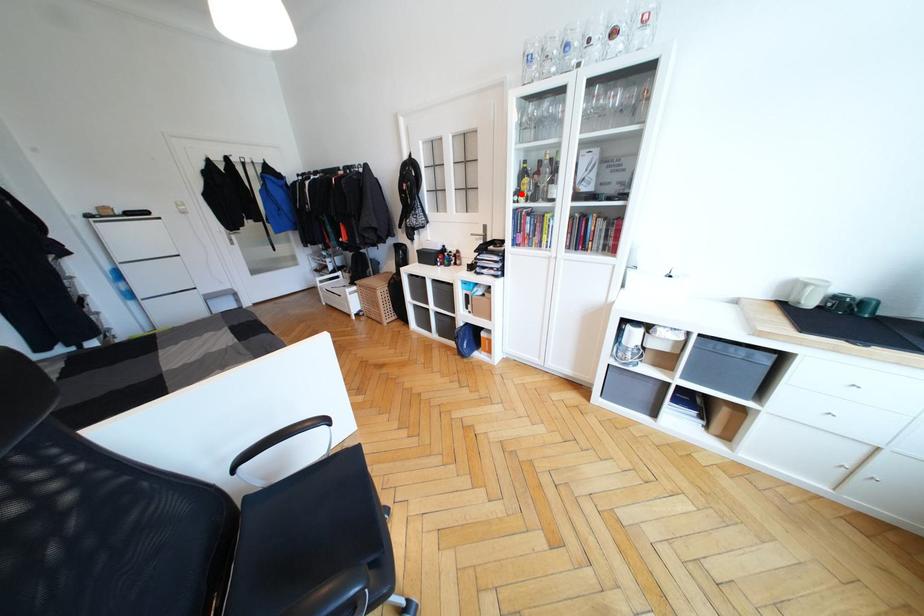
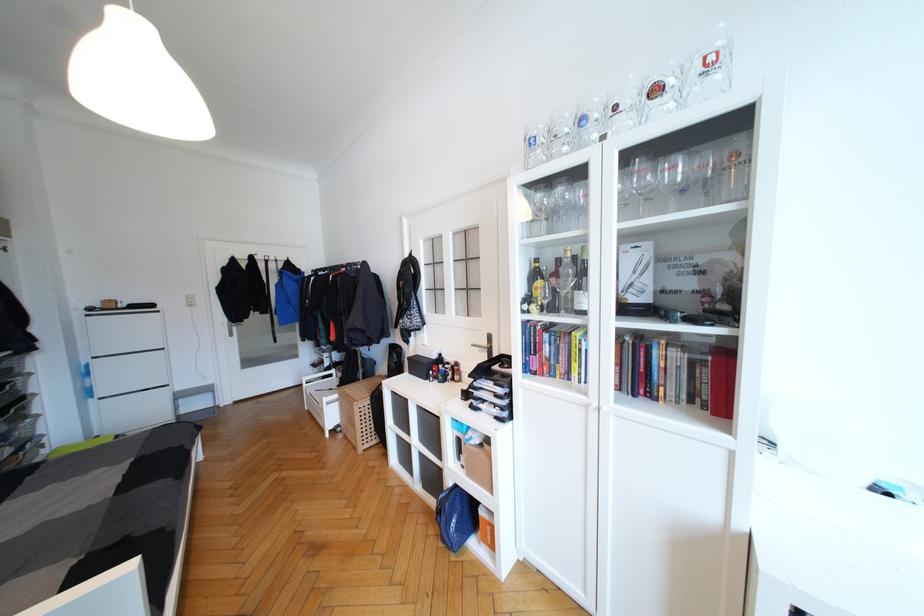
Find the pixel in the second image that matches the highlighted location in the first image.

(531, 301)